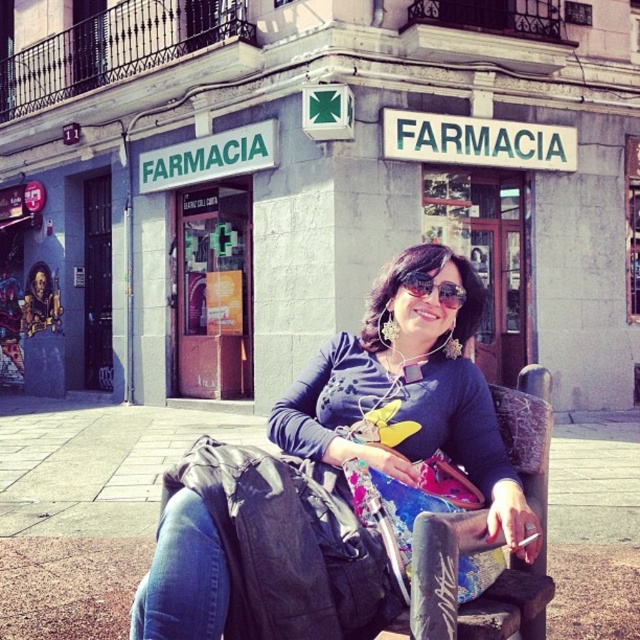
You are a photographer trying to capture the woman in front of the pharmacy. To get a clear shot of her face, you need to ensure that the matte black jacket at center and the sunglasses at center are not blocking her face. Based on their sizes, which object should you be more cautious about obstructing the view?

The matte black jacket at center is taller than sunglasses at center, so you should be more cautious about the matte black jacket at center obstructing the view since it is larger in height.

You are a fashion designer observing the scene at the pharmacy. You notice the matte black jacket at center and the denim at lower left. Which item of clothing is larger in size?

The matte black jacket at center is bigger than the denim at lower left.